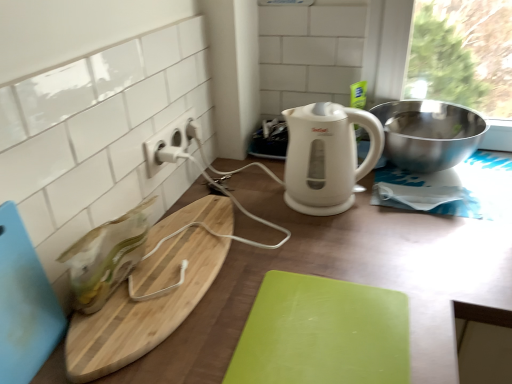
You are a GUI agent. You are given a task and a screenshot of the screen. Output one action in this format:
    pyautogui.click(x=<x>, y=<y>)
    Task: Click on the free space in front of white glossy electric kettle at center
    
    Given the screenshot: What is the action you would take?
    pyautogui.click(x=357, y=244)